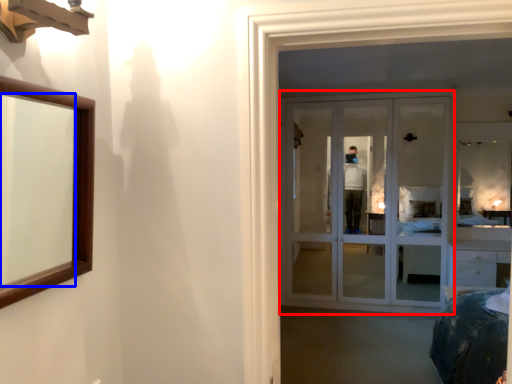
Question: Which point is further to the camera, door (highlighted by a red box) or mirror (highlighted by a blue box)?

Choices:
 (A) door
 (B) mirror

Answer: (A)